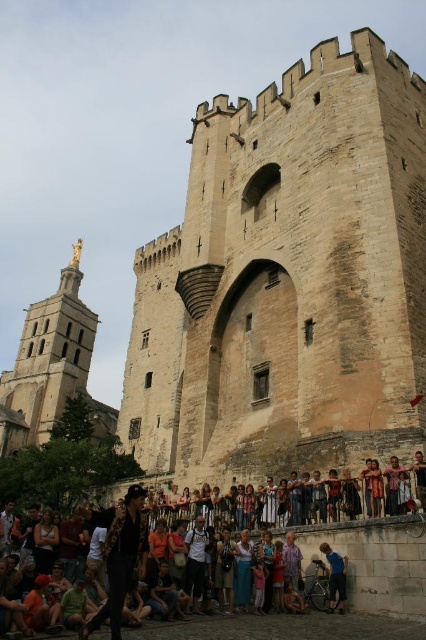
Question: Does beige stone tower at center have a smaller size compared to golden statue at upper left?

Choices:
 (A) yes
 (B) no

Answer: (A)

Question: Which of these objects is positioned closest to the denim shorts at lower center?

Choices:
 (A) blue denim jeans at lower center
 (B) golden statue at upper left
 (C) beige stone tower at center

Answer: (A)

Question: In this image, where is denim shorts at lower center located relative to blue denim jeans at lower center?

Choices:
 (A) right
 (B) left

Answer: (B)

Question: Which point is farther from the camera taking this photo?

Choices:
 (A) (54, 390)
 (B) (374, 204)

Answer: (A)

Question: Is golden statue at upper left above matte black shirt at lower left?

Choices:
 (A) yes
 (B) no

Answer: (A)

Question: Among these objects, which one is nearest to the camera?

Choices:
 (A) denim shorts at lower center
 (B) golden statue at upper left
 (C) multicolored casual clothing at lower center
 (D) beige stone tower at center

Answer: (C)